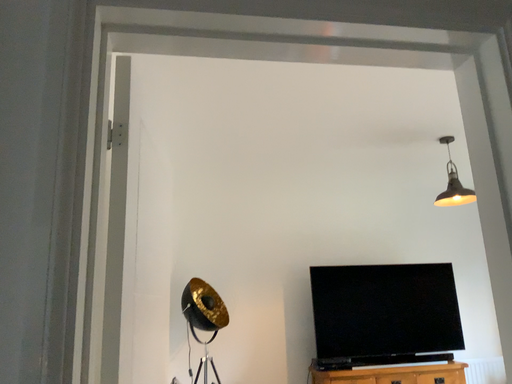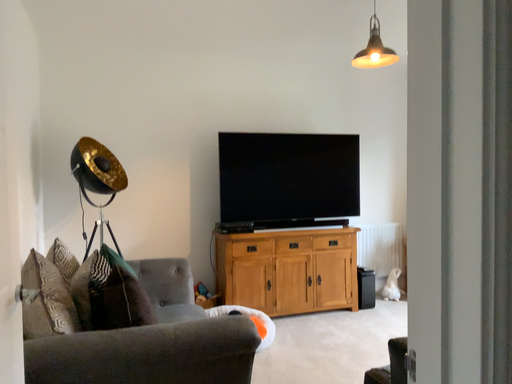
Question: How did the camera likely rotate when shooting the video?

Choices:
 (A) rotated downward
 (B) rotated upward

Answer: (A)